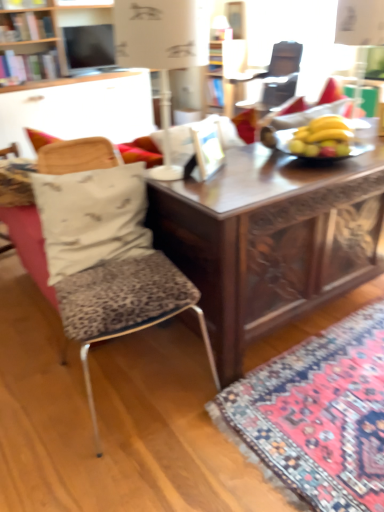
Question: Considering the positions of point (311, 431) and point (254, 145), is point (311, 431) closer or farther from the camera than point (254, 145)?

Choices:
 (A) closer
 (B) farther

Answer: (A)

Question: Choose the correct answer: Is carpet with intricate patterns at lower right inside wooden carved desk at center or outside it?

Choices:
 (A) outside
 (B) inside

Answer: (A)

Question: Which is farther from the white paper lampshade at upper center?

Choices:
 (A) matte black television at upper center
 (B) yellow matte bananas at center
 (C) carpet with intricate patterns at lower right
 (D) white fabric pillow at left
 (E) wooden carved desk at center

Answer: (C)

Question: Which object is the farthest from the carpet with intricate patterns at lower right?

Choices:
 (A) matte black television at upper center
 (B) yellow matte bananas at center
 (C) leopard print fabric chair at left
 (D) white fabric pillow at left
 (E) white paper lampshade at upper center

Answer: (A)